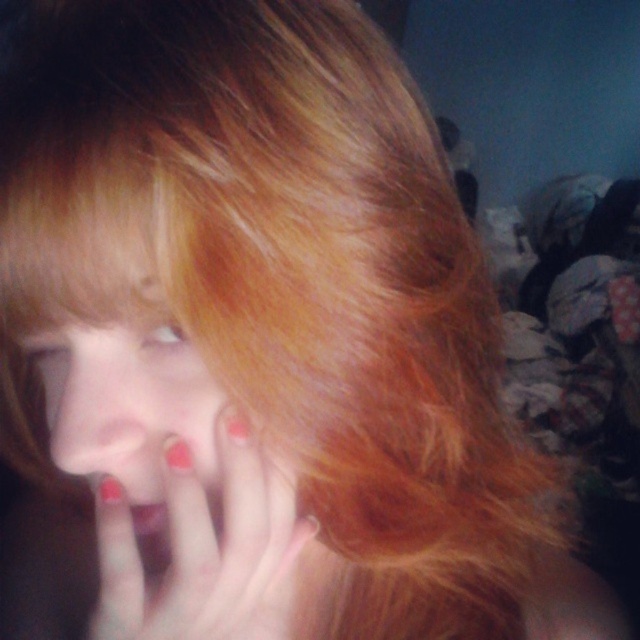
Question: Is glossy nail polish at center to the right of matte red nails at center from the viewer's perspective?

Choices:
 (A) no
 (B) yes

Answer: (B)

Question: Which of the following is the farthest from the observer?

Choices:
 (A) (314, 529)
 (B) (138, 378)

Answer: (A)

Question: Considering the relative positions of glossy nail polish at center and matte red nails at center in the image provided, where is glossy nail polish at center located with respect to matte red nails at center?

Choices:
 (A) below
 (B) above

Answer: (A)

Question: Does glossy nail polish at center have a lesser width compared to matte red nails at center?

Choices:
 (A) yes
 (B) no

Answer: (A)